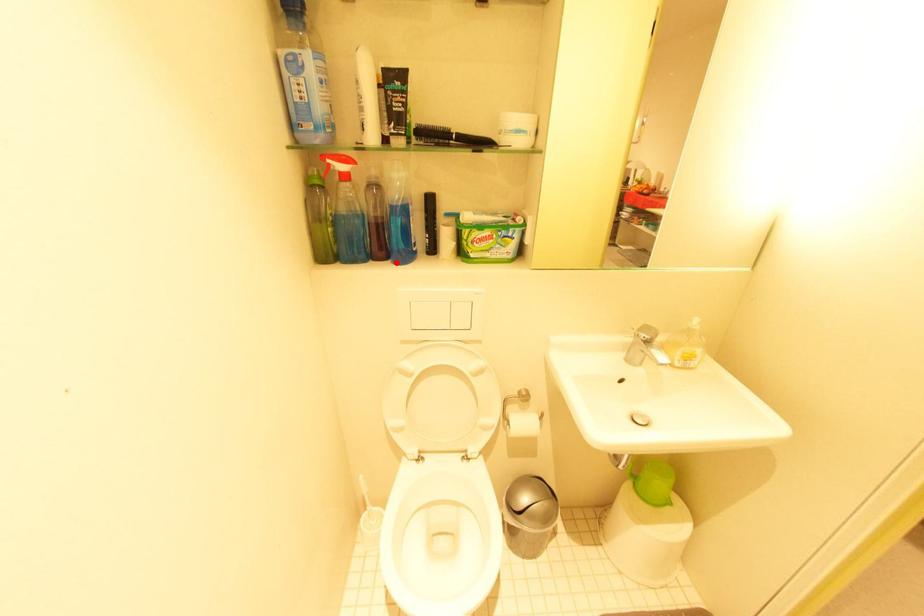
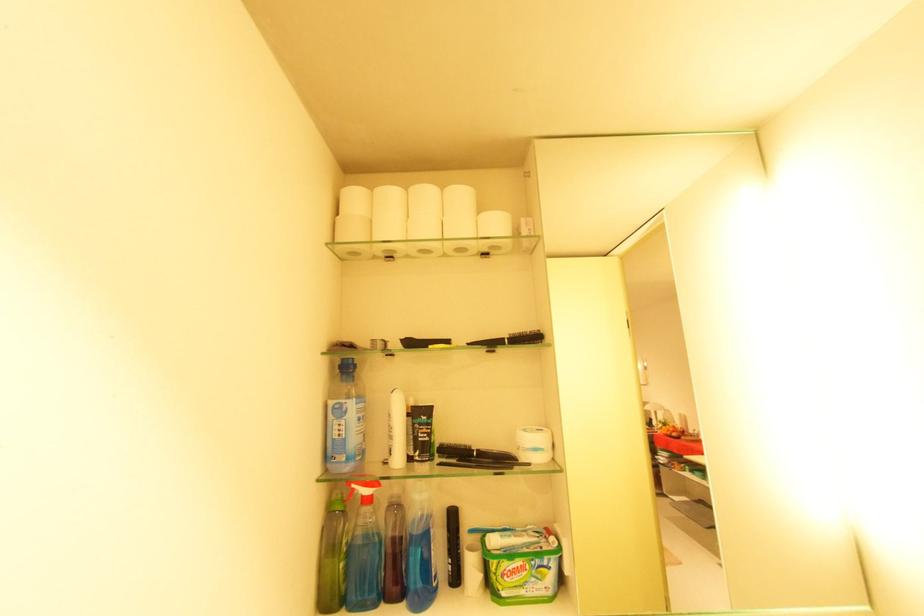
Locate, in the second image, the point that corresponds to the highlighted location in the first image.

(410, 605)